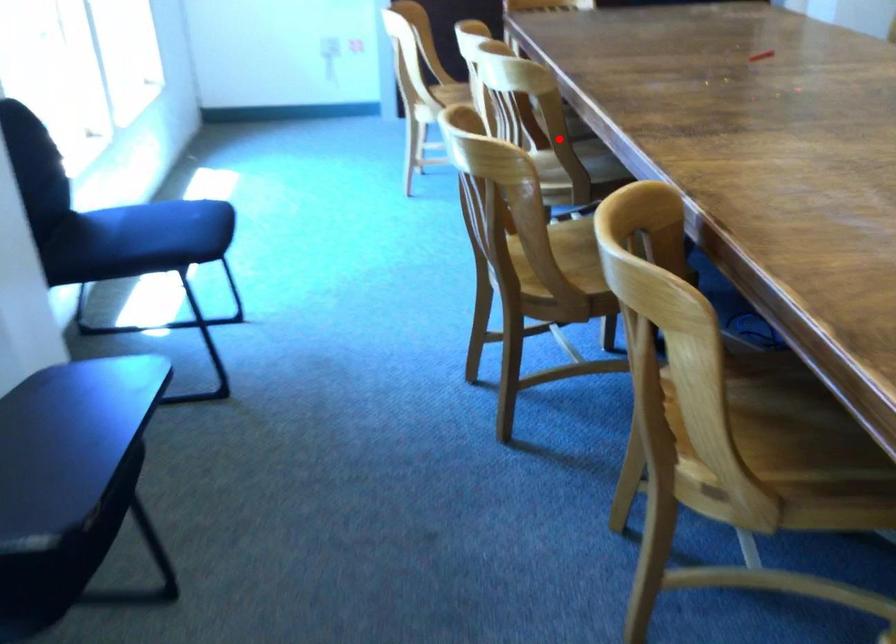
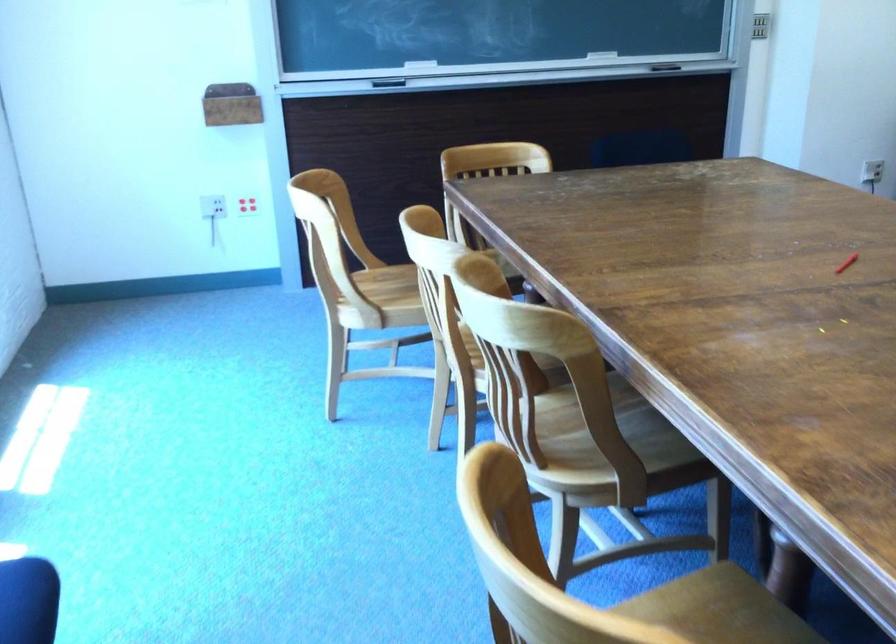
Question: I am providing you with two images of the same scene from different viewpoints. A red point is shown in image1. For the corresponding object point in image2, is it positioned nearer or farther from the camera?

Choices:
 (A) Nearer
 (B) Farther

Answer: (A)